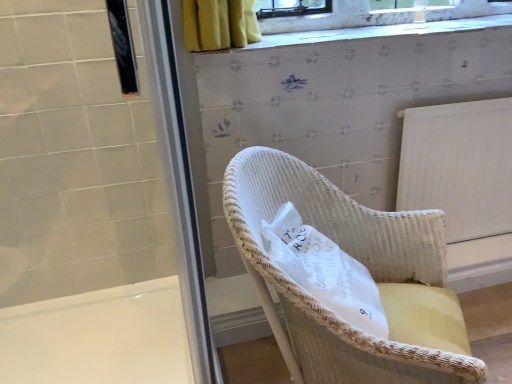
Question: Considering the positions of white wicker chair at center and white glossy bath at lower left in the image, is white wicker chair at center bigger or smaller than white glossy bath at lower left?

Choices:
 (A) big
 (B) small

Answer: (B)

Question: Is point (284, 221) positioned closer to the camera than point (140, 344)?

Choices:
 (A) closer
 (B) farther

Answer: (A)

Question: Which object is positioned closest to the white wicker chair at center?

Choices:
 (A) white glossy screen door at upper left, the 2th screen door in the right-to-left sequence
 (B) woven white chair at center
 (C) transparent plastic screen door at left, placed as the first screen door when sorted from right to left
 (D) white glossy bath at lower left

Answer: (B)

Question: Estimate the real-world distances between objects in this image. Which object is farther from the woven white chair at center?

Choices:
 (A) white glossy screen door at upper left, which appears as the 1th screen door when viewed from the left
 (B) transparent plastic screen door at left, placed as the first screen door when sorted from right to left
 (C) white glossy bath at lower left
 (D) white wicker chair at center

Answer: (C)